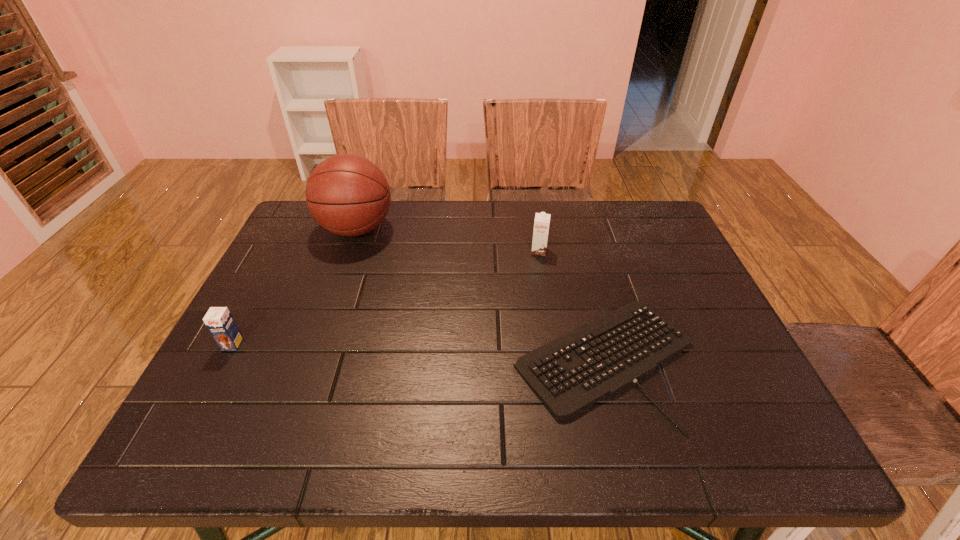
Locate an element on the screen. Image resolution: width=960 pixels, height=540 pixels. free space at the left edge is located at coordinates (275, 278).

In the image, there is a desktop. In order to click on vacant space at the right edge in this screenshot , I will do pyautogui.click(x=683, y=376).

Locate an element on the screen. This screenshot has height=540, width=960. vacant space at the near left corner is located at coordinates (209, 439).

Find the location of a particular element. This screenshot has width=960, height=540. blank space at the far right corner is located at coordinates (610, 206).

The width and height of the screenshot is (960, 540). What are the coordinates of `vacant region at the near right corner` in the screenshot? It's located at (727, 442).

I want to click on blank region between the right chocolate milk and the basketball, so click(x=447, y=240).

Where is `free point between the left chocolate milk and the farther chocolate milk`? This screenshot has width=960, height=540. free point between the left chocolate milk and the farther chocolate milk is located at coordinates (386, 298).

Identify the location of free space between the basketball and the farther chocolate milk. (447, 240).

Locate an element on the screen. free spot between the left chocolate milk and the farther chocolate milk is located at coordinates tap(386, 298).

The image size is (960, 540). Find the location of `vacant space that's between the basketball and the shortest object`. vacant space that's between the basketball and the shortest object is located at coordinates (481, 295).